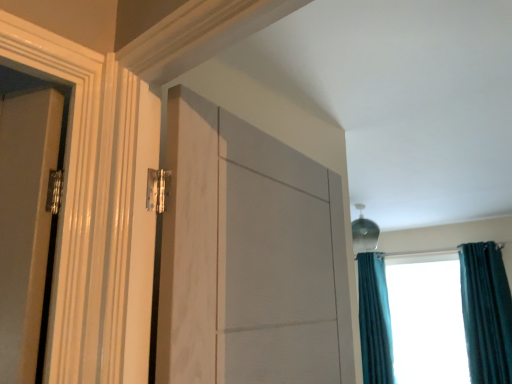
Question: Is teal curtain at right positioned behind white marble door at center?

Choices:
 (A) yes
 (B) no

Answer: (A)

Question: From the image's perspective, is teal curtain at right on top of white marble door at center?

Choices:
 (A) no
 (B) yes

Answer: (A)

Question: Is teal curtain at right thinner than white marble door at center?

Choices:
 (A) yes
 (B) no

Answer: (B)

Question: From a real-world perspective, is teal curtain at right positioned under white marble door at center based on gravity?

Choices:
 (A) yes
 (B) no

Answer: (A)

Question: Is teal curtain at right positioned with its back to white marble door at center?

Choices:
 (A) no
 (B) yes

Answer: (A)

Question: Is teal curtain at right shorter than white marble door at center?

Choices:
 (A) no
 (B) yes

Answer: (A)

Question: Does teal velvet curtain at right, which appears as the second curtain when viewed from the back, have a greater height compared to teal velvet curtain at right, which is the first curtain in back-to-front order?

Choices:
 (A) no
 (B) yes

Answer: (A)

Question: Does teal velvet curtain at right, which is the first curtain in front-to-back order, have a lesser height compared to teal velvet curtain at right, which is the first curtain in back-to-front order?

Choices:
 (A) yes
 (B) no

Answer: (A)

Question: Is teal velvet curtain at right, which is the first curtain in front-to-back order, further to the viewer compared to teal velvet curtain at right, which is the second curtain from front to back?

Choices:
 (A) no
 (B) yes

Answer: (A)

Question: Is teal velvet curtain at right, which is the first curtain in front-to-back order, directly adjacent to teal velvet curtain at right, marked as the second curtain in a right-to-left arrangement?

Choices:
 (A) yes
 (B) no

Answer: (B)

Question: Can you confirm if teal velvet curtain at right, which is the first curtain in front-to-back order, is positioned to the left of teal velvet curtain at right, the 1th curtain when ordered from left to right?

Choices:
 (A) no
 (B) yes

Answer: (A)

Question: From a real-world perspective, is teal velvet curtain at right, the first curtain viewed from the right, located beneath teal velvet curtain at right, which is the first curtain in back-to-front order?

Choices:
 (A) no
 (B) yes

Answer: (A)

Question: Is teal curtain at right taller than teal velvet curtain at right, marked as the second curtain in a left-to-right arrangement?

Choices:
 (A) yes
 (B) no

Answer: (A)